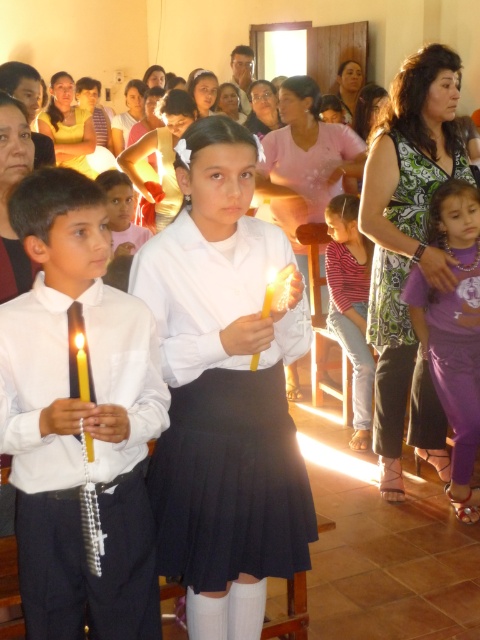
Question: Which object is positioned closest to the yellow wax candle at center?

Choices:
 (A) matte white shirt at center
 (B) striped fabric shirt at center
 (C) purple satin dress at lower right

Answer: (A)

Question: Does matte white shirt at center have a smaller size compared to purple satin dress at lower right?

Choices:
 (A) no
 (B) yes

Answer: (B)

Question: Can you confirm if purple satin dress at lower right is smaller than striped fabric shirt at center?

Choices:
 (A) no
 (B) yes

Answer: (A)

Question: Based on their relative distances, which object is farther from the purple satin dress at lower right?

Choices:
 (A) matte white shirt at center
 (B) yellow wax candle at center
 (C) striped fabric shirt at center

Answer: (B)

Question: Estimate the real-world distances between objects in this image. Which object is farther from the purple satin dress at lower right?

Choices:
 (A) striped fabric shirt at center
 (B) matte white shirt at center

Answer: (B)

Question: In this image, where is striped fabric shirt at center located relative to yellow wax candle at center?

Choices:
 (A) right
 (B) left

Answer: (A)